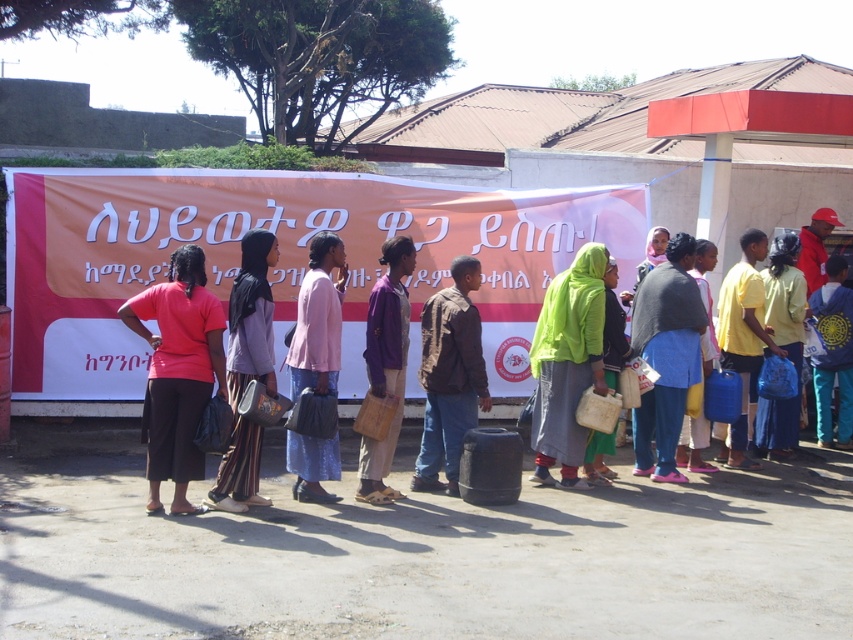
Question: Which object is the closest to the brown leather jacket at center?

Choices:
 (A) blue fabric bag at center
 (B) matte purple fabric at center
 (C) matte pink shirt at left
 (D) yellow fabric bag at right

Answer: (B)

Question: Does yellow matte water at right appear on the left side of yellow fabric bag at right?

Choices:
 (A) yes
 (B) no

Answer: (A)

Question: Which point is farther from the camera taking this photo?

Choices:
 (A) (265, 282)
 (B) (322, 266)
 (C) (567, 301)
 (D) (390, 356)

Answer: (C)

Question: Does blue fabric bag at center have a lesser width compared to brown leather jacket at center?

Choices:
 (A) yes
 (B) no

Answer: (B)

Question: Which of the following is the closest to the observer?

Choices:
 (A) pos(178,413)
 (B) pos(318,253)
 (C) pos(402,369)

Answer: (A)

Question: Can you confirm if green fabric headscarf at center is bigger than matte purple fabric at center?

Choices:
 (A) no
 (B) yes

Answer: (B)